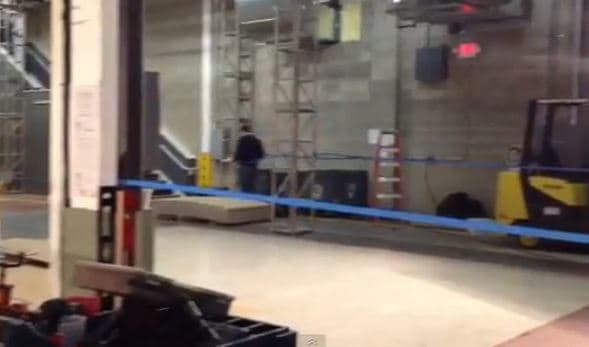
Identify the location of wall. This screenshot has width=589, height=347. (454, 125).